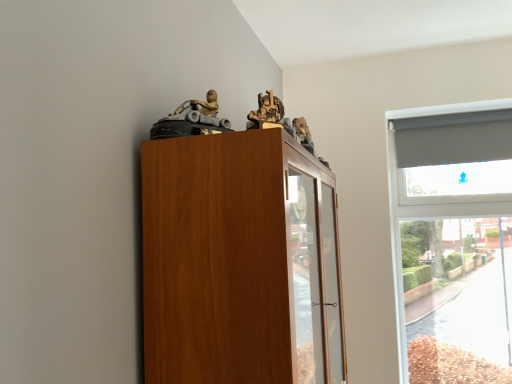
Question: From a real-world perspective, is matte gray plastic toy car at upper center, which ranks as the first toy in left-to-right order, positioned above or below wooden figure at upper center, the 2th toy viewed from the left?

Choices:
 (A) below
 (B) above

Answer: (A)

Question: Does point (189, 124) appear closer or farther from the camera than point (261, 102)?

Choices:
 (A) farther
 (B) closer

Answer: (A)

Question: Estimate the real-world distances between objects in this image. Which object is farther from the wooden cabinet at upper left?

Choices:
 (A) wooden figure at upper center, the first toy in the right-to-left sequence
 (B) matte gray plastic toy car at upper center, which ranks as the first toy in left-to-right order

Answer: (A)

Question: Estimate the real-world distances between objects in this image. Which object is closer to the matte gray plastic toy car at upper center, which ranks as the first toy in left-to-right order?

Choices:
 (A) wooden figure at upper center, the first toy in the right-to-left sequence
 (B) wooden cabinet at upper left

Answer: (A)